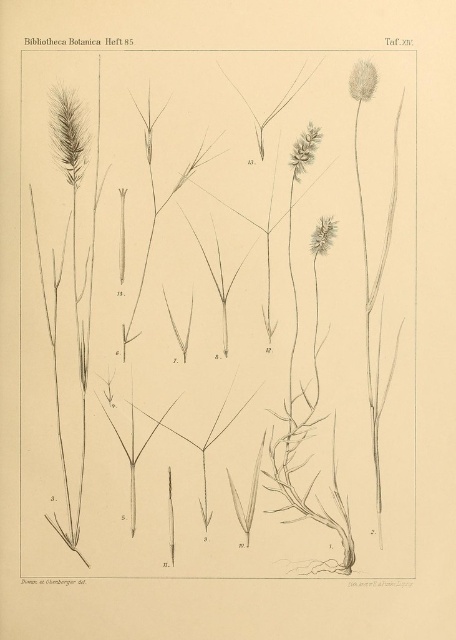
You are a botanist examining the botanical illustration from the book. You need to locate the brown textured seed head at upper center. Where exactly is it positioned on the illustration?

The brown textured seed head at upper center is located at coordinates point (304, 150).

Based on the botanical illustration from the specified source, which object is located at the coordinates point (x=304, y=150)?

The point (x=304, y=150) indicates a brown textured seed head at upper center.

You are an entomologist examining the botanical illustration. You need to determine if a 2.5 inch long measuring tool can fit between the brown textured seed head at upper center and the brown textured flower at center. Can it?

The distance between the brown textured seed head at upper center and the brown textured flower at center is 4.16 inches. Since the measuring tool is 2.5 inches long, it can fit between them as the space is larger than the tool.